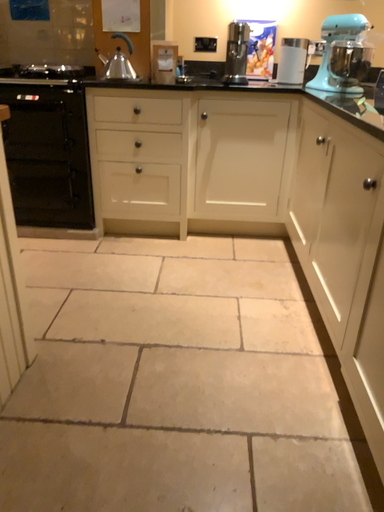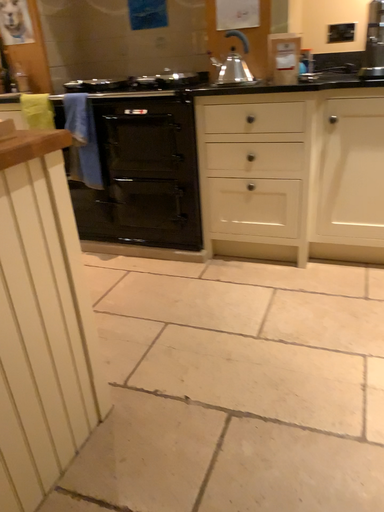
Question: Which way did the camera rotate in the video?

Choices:
 (A) rotated left
 (B) rotated right

Answer: (A)